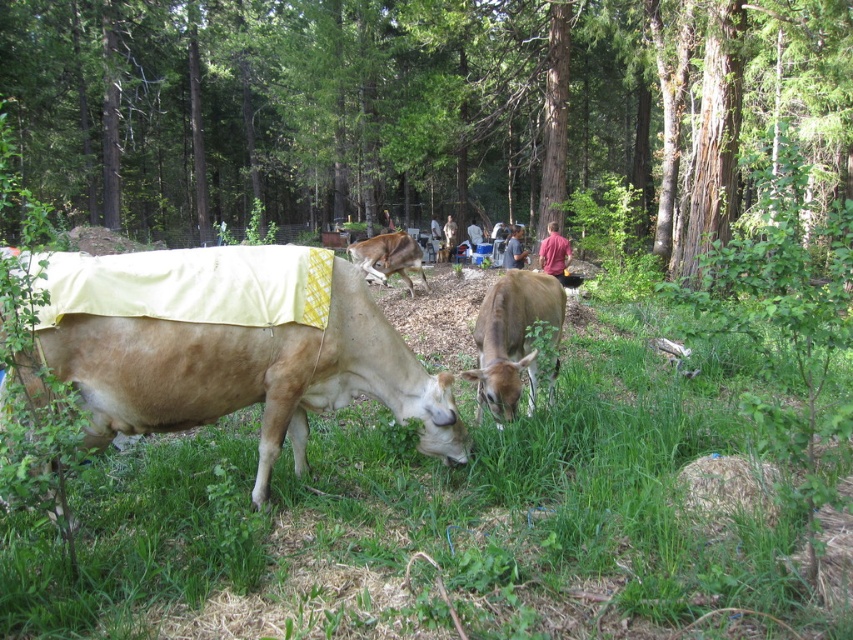
Question: Which of the following is the closest to the observer?

Choices:
 (A) green leafy tree at center
 (B) light brown fabric-covered cow at lower left

Answer: (A)

Question: Which point is closer to the camera?

Choices:
 (A) green leafy tree at center
 (B) green grassy at center
 (C) brown furry dog at center

Answer: (B)

Question: Can you confirm if green leafy tree at center is thinner than green grassy at center?

Choices:
 (A) yes
 (B) no

Answer: (B)

Question: Which of the following is the closest to the observer?

Choices:
 (A) brown matte cow at center
 (B) light brown fabric-covered cow at lower left
 (C) brown furry dog at center
 (D) green leafy tree at center

Answer: (D)

Question: Can you confirm if brown matte cow at center is positioned below brown furry dog at center?

Choices:
 (A) yes
 (B) no

Answer: (A)

Question: Considering the relative positions of green leafy tree at center and brown matte cow at center in the image provided, where is green leafy tree at center located with respect to brown matte cow at center?

Choices:
 (A) below
 (B) above

Answer: (B)